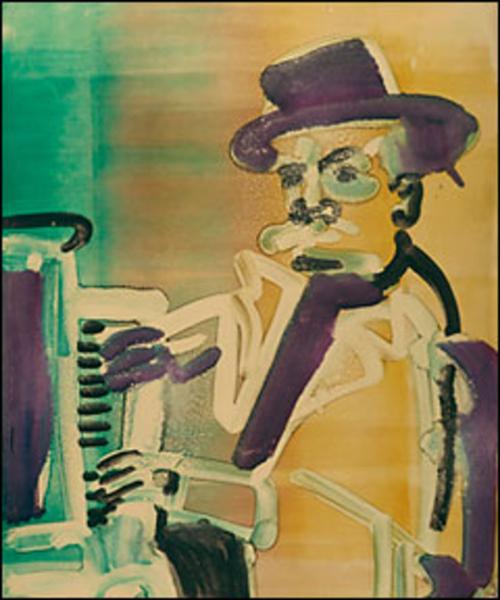
Identify the location of piano. (35, 366).